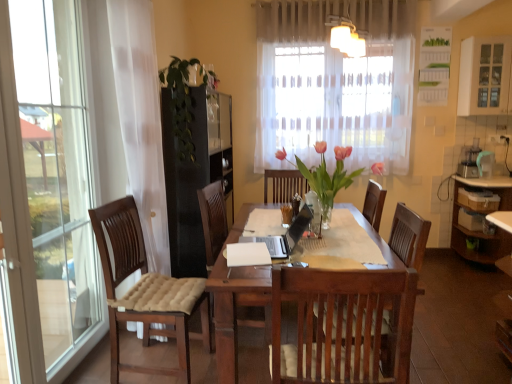
Question: From the image's perspective, does green leafy plant at center, which is the second floral arrangement in right-to-left order, appear lower than white glass cabinet at upper right?

Choices:
 (A) yes
 (B) no

Answer: (A)

Question: Considering the relative positions of green leafy plant at center, which is the second floral arrangement in right-to-left order, and white glass cabinet at upper right in the image provided, is green leafy plant at center, which is the second floral arrangement in right-to-left order, in front of white glass cabinet at upper right?

Choices:
 (A) no
 (B) yes

Answer: (B)

Question: Is green leafy plant at center, which is the second floral arrangement in front-to-back order, facing towards white glass cabinet at upper right?

Choices:
 (A) yes
 (B) no

Answer: (B)

Question: Does green leafy plant at center, the first floral arrangement positioned from the back, have a lesser height compared to white glass cabinet at upper right?

Choices:
 (A) no
 (B) yes

Answer: (A)

Question: Is green leafy plant at center, the first floral arrangement positioned from the back, looking in the opposite direction of white glass cabinet at upper right?

Choices:
 (A) yes
 (B) no

Answer: (B)

Question: Does green leafy plant at center, placed as the 1th floral arrangement when sorted from left to right, have a larger size compared to white glass cabinet at upper right?

Choices:
 (A) no
 (B) yes

Answer: (B)

Question: Is green leafy plant at center, the first floral arrangement positioned from the back, located within white glass cabinet at upper right?

Choices:
 (A) yes
 (B) no

Answer: (B)

Question: Is white glass cabinet at upper right positioned in front of green leafy plant at center, placed as the 1th floral arrangement when sorted from left to right?

Choices:
 (A) yes
 (B) no

Answer: (B)

Question: From the image's perspective, is white glass cabinet at upper right on top of green leafy plant at center, which is the second floral arrangement in right-to-left order?

Choices:
 (A) yes
 (B) no

Answer: (A)

Question: Is white glass cabinet at upper right taller than green leafy plant at center, which is the second floral arrangement in right-to-left order?

Choices:
 (A) yes
 (B) no

Answer: (B)

Question: Is white glass cabinet at upper right further to camera compared to green leafy plant at center, which is the second floral arrangement in right-to-left order?

Choices:
 (A) no
 (B) yes

Answer: (B)

Question: Can you confirm if white glass cabinet at upper right is positioned to the left of green leafy plant at center, which is the second floral arrangement in front-to-back order?

Choices:
 (A) no
 (B) yes

Answer: (A)

Question: Is translucent glass vase at center, the first floral arrangement positioned from the right, looking in the opposite direction of green leafy plant at center, which is the second floral arrangement in front-to-back order?

Choices:
 (A) no
 (B) yes

Answer: (A)